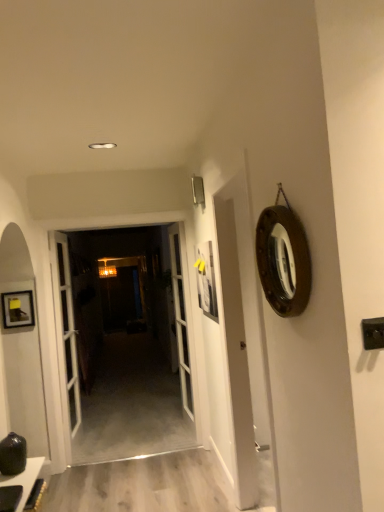
Question: Does white glass door at center, acting as the 1th door starting from the right, have a lesser width compared to white glass door at center, the 3th door when ordered from right to left?

Choices:
 (A) yes
 (B) no

Answer: (A)

Question: Are white glass door at center, acting as the 1th door starting from the right, and white glass door at center, the 3th door when ordered from right to left, located far from each other?

Choices:
 (A) no
 (B) yes

Answer: (B)

Question: Does white glass door at center, marked as the third door in a left-to-right arrangement, have a larger size compared to white glass door at center, which is counted as the 1th door, starting from the left?

Choices:
 (A) no
 (B) yes

Answer: (B)

Question: Is white glass door at center, marked as the third door in a left-to-right arrangement, smaller than white glass door at center, the 3th door when ordered from right to left?

Choices:
 (A) yes
 (B) no

Answer: (B)

Question: Does white glass door at center, acting as the 1th door starting from the right, have a greater height compared to white glass door at center, which is counted as the 1th door, starting from the left?

Choices:
 (A) yes
 (B) no

Answer: (A)

Question: Is white glass door at center, which is counted as the 1th door, starting from the left, wider or thinner than white glass door at center, which appears as the 2th door when viewed from the right?

Choices:
 (A) wide
 (B) thin

Answer: (A)

Question: Considering the positions of point (74, 432) and point (92, 283), is point (74, 432) closer or farther from the camera than point (92, 283)?

Choices:
 (A) farther
 (B) closer

Answer: (B)

Question: Is white glass door at center, which is counted as the 1th door, starting from the left, inside the boundaries of white glass door at center, which appears as the 2th door when viewed from the right, or outside?

Choices:
 (A) outside
 (B) inside

Answer: (A)

Question: Looking at the image, does white glass door at center, the 3th door when ordered from right to left, seem bigger or smaller compared to white glass door at center, the 2th door in the left-to-right sequence?

Choices:
 (A) small
 (B) big

Answer: (A)

Question: Is point (180, 462) positioned closer to the camera than point (66, 361)?

Choices:
 (A) farther
 (B) closer

Answer: (B)

Question: Do you think smooth gray carpet at center is within white glass door at center, which appears as the 2th door when viewed from the right, or outside of it?

Choices:
 (A) outside
 (B) inside

Answer: (A)

Question: From a real-world perspective, relative to white glass door at center, the 2th door in the left-to-right sequence, is smooth gray carpet at center vertically above or below?

Choices:
 (A) below
 (B) above

Answer: (A)

Question: Based on their positions, is smooth gray carpet at center located to the left or right of white glass door at center, which appears as the 2th door when viewed from the right?

Choices:
 (A) right
 (B) left

Answer: (A)

Question: From a real-world perspective, is white glass door at center, the 2th door in the left-to-right sequence, positioned above or below white glass door at center, the 3th door when ordered from right to left?

Choices:
 (A) above
 (B) below

Answer: (A)

Question: In the image, is white glass door at center, which appears as the 2th door when viewed from the right, positioned in front of or behind white glass door at center, the 3th door when ordered from right to left?

Choices:
 (A) front
 (B) behind

Answer: (B)